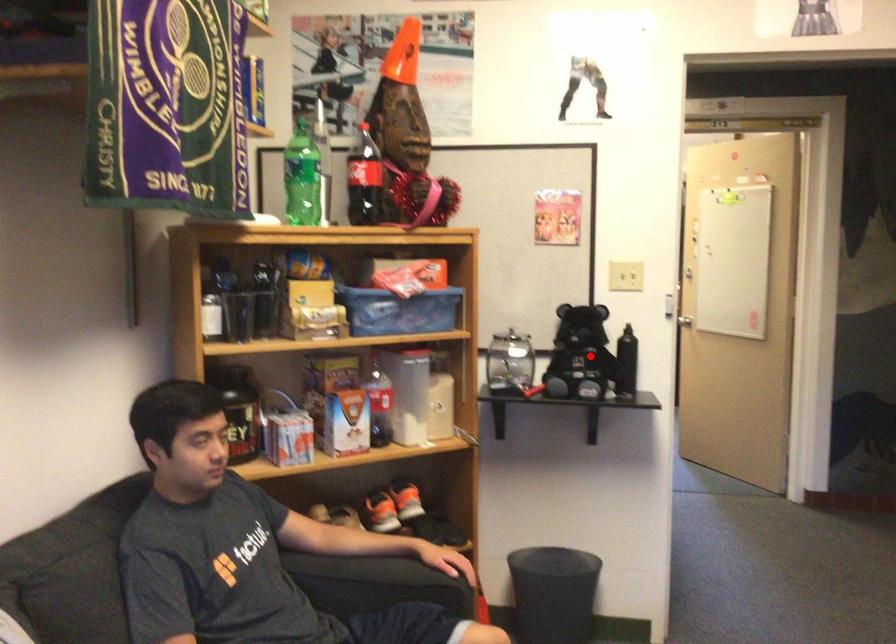
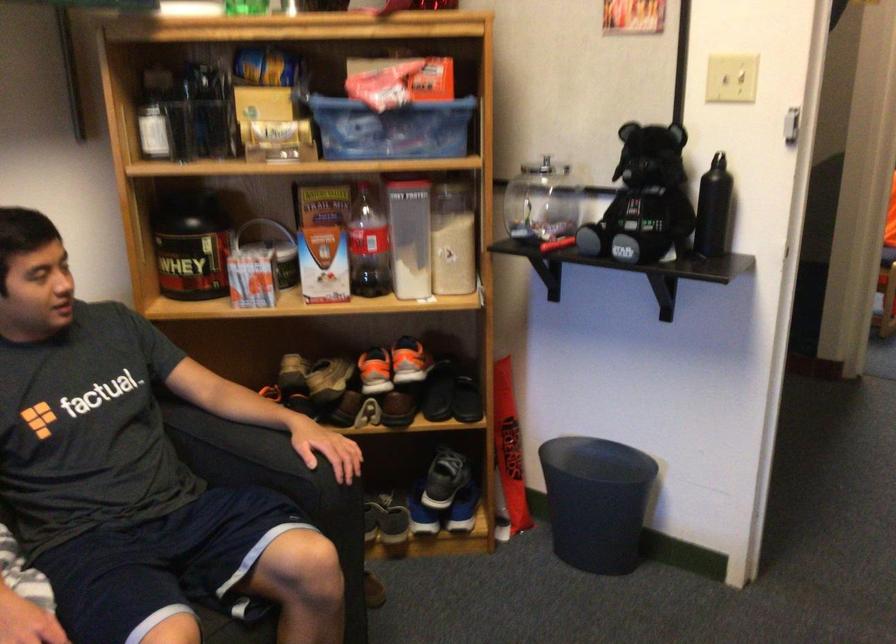
Question: A red point is marked in image1. In image2, is the corresponding 3D point closer to the camera or farther? Reply with the corresponding letter.

Choices:
 (A) The corresponding 3D point is closer.
 (B) The corresponding 3D point is farther.

Answer: (A)